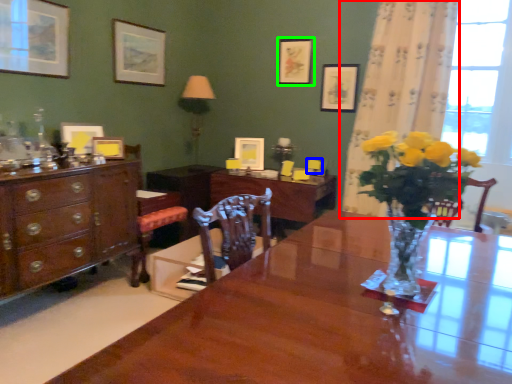
Question: Which object is the farthest from curtain (highlighted by a red box)? Choose among these: armchair (highlighted by a blue box) or picture frame (highlighted by a green box).

Choices:
 (A) armchair
 (B) picture frame

Answer: (A)